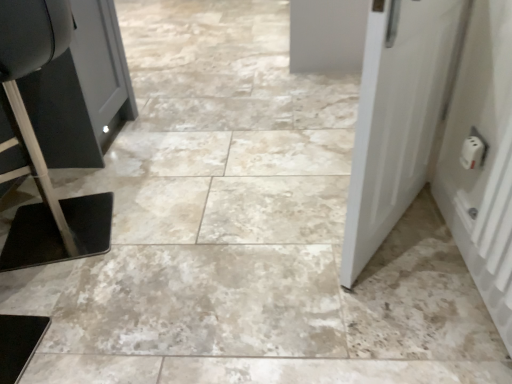
The image size is (512, 384). What do you see at coordinates (472, 152) in the screenshot?
I see `white plastic outlet at right` at bounding box center [472, 152].

The image size is (512, 384). In order to click on white matte door at right, positioned as the 2th door in right-to-left order in this screenshot , I will do `click(398, 115)`.

The width and height of the screenshot is (512, 384). I want to click on white plastic outlet at right, so click(x=472, y=152).

Is white plastic outlet at right far away from white plastic door at right, marked as the first door in a right-to-left arrangement?

No, there isn't a large distance between white plastic outlet at right and white plastic door at right, marked as the first door in a right-to-left arrangement.

From the image's perspective, is white plastic outlet at right over white plastic door at right, arranged as the 2th door when viewed from the left?

Correct, white plastic outlet at right appears higher than white plastic door at right, arranged as the 2th door when viewed from the left, in the image.

Which is in front, white plastic outlet at right or white plastic door at right, marked as the first door in a right-to-left arrangement?

white plastic door at right, marked as the first door in a right-to-left arrangement, is closer to the camera.

Is white plastic door at right, arranged as the 2th door when viewed from the left, oriented towards white matte door at right, the first door in the left-to-right sequence?

No, white plastic door at right, arranged as the 2th door when viewed from the left, does not turn towards white matte door at right, the first door in the left-to-right sequence.

Who is shorter, white plastic door at right, arranged as the 2th door when viewed from the left, or white matte door at right, the first door in the left-to-right sequence?

white plastic door at right, arranged as the 2th door when viewed from the left.

Would you say white plastic door at right, arranged as the 2th door when viewed from the left, is to the left or to the right of white matte door at right, the first door in the left-to-right sequence, in the picture?

From the image, it's evident that white plastic door at right, arranged as the 2th door when viewed from the left, is to the right of white matte door at right, the first door in the left-to-right sequence.

Is white plastic door at right, marked as the first door in a right-to-left arrangement, positioned behind white matte door at right, the first door in the left-to-right sequence?

No, it is not.

From the image's perspective, is white plastic door at right, marked as the first door in a right-to-left arrangement, above white plastic outlet at right?

No, from the image's perspective, white plastic door at right, marked as the first door in a right-to-left arrangement, is not above white plastic outlet at right.

Which of these two, white plastic door at right, marked as the first door in a right-to-left arrangement, or white plastic outlet at right, stands taller?

white plastic door at right, marked as the first door in a right-to-left arrangement, is taller.

Who is smaller, white plastic door at right, marked as the first door in a right-to-left arrangement, or white plastic outlet at right?

Smaller between the two is white plastic outlet at right.

Is white plastic outlet at right at the back of white plastic door at right, marked as the first door in a right-to-left arrangement?

white plastic door at right, marked as the first door in a right-to-left arrangement, does not have its back to white plastic outlet at right.

Would you say white matte door at right, positioned as the 2th door in right-to-left order, contains white plastic outlet at right?

No, white matte door at right, positioned as the 2th door in right-to-left order, does not contain white plastic outlet at right.

From the image's perspective, is white matte door at right, the first door in the left-to-right sequence, located above or below white plastic outlet at right?

white matte door at right, the first door in the left-to-right sequence, is above white plastic outlet at right.

Considering the relative sizes of white matte door at right, positioned as the 2th door in right-to-left order, and white plastic outlet at right in the image provided, is white matte door at right, positioned as the 2th door in right-to-left order, thinner than white plastic outlet at right?

Incorrect, the width of white matte door at right, positioned as the 2th door in right-to-left order, is not less than that of white plastic outlet at right.

This screenshot has width=512, height=384. What are the coordinates of `electric outlet behind the white matte door at right, positioned as the 2th door in right-to-left order` in the screenshot? It's located at (472, 152).

Considering the sizes of white plastic outlet at right and white matte door at right, the first door in the left-to-right sequence, in the image, is white plastic outlet at right wider or thinner than white matte door at right, the first door in the left-to-right sequence,?

Considering their sizes, white plastic outlet at right looks slimmer than white matte door at right, the first door in the left-to-right sequence.

In terms of size, does white plastic outlet at right appear bigger or smaller than white matte door at right, the first door in the left-to-right sequence?

Clearly, white plastic outlet at right is smaller in size than white matte door at right, the first door in the left-to-right sequence.

How far apart are white plastic outlet at right and white matte door at right, positioned as the 2th door in right-to-left order?

A distance of 35.17 centimeters exists between white plastic outlet at right and white matte door at right, positioned as the 2th door in right-to-left order.

Considering the sizes of objects white plastic outlet at right and white matte door at right, positioned as the 2th door in right-to-left order, in the image provided, who is shorter, white plastic outlet at right or white matte door at right, positioned as the 2th door in right-to-left order,?

white plastic outlet at right.

Where is `door below the white matte door at right, positioned as the 2th door in right-to-left order (from the image's perspective)`? The image size is (512, 384). door below the white matte door at right, positioned as the 2th door in right-to-left order (from the image's perspective) is located at coordinates (484, 159).

Consider the image. Is white matte door at right, positioned as the 2th door in right-to-left order, closer to camera compared to white plastic door at right, arranged as the 2th door when viewed from the left?

No, white matte door at right, positioned as the 2th door in right-to-left order, is further to the viewer.

Considering the positions of point (364, 162) and point (481, 223), is point (364, 162) closer or farther from the camera than point (481, 223)?

Clearly, point (364, 162) is closer to the camera than point (481, 223).

The height and width of the screenshot is (384, 512). Identify the location of the 1st door counting from the left side of the white plastic outlet at right. (484, 159).

Image resolution: width=512 pixels, height=384 pixels. I want to click on door on the right of white matte door at right, positioned as the 2th door in right-to-left order, so click(x=484, y=159).

Which object lies nearer to the anchor point white matte door at right, positioned as the 2th door in right-to-left order, white plastic door at right, arranged as the 2th door when viewed from the left, or white plastic outlet at right?

white plastic door at right, arranged as the 2th door when viewed from the left, is positioned closer to the anchor white matte door at right, positioned as the 2th door in right-to-left order.

Based on their spatial positions, is white matte door at right, positioned as the 2th door in right-to-left order, or white plastic outlet at right closer to white plastic door at right, arranged as the 2th door when viewed from the left?

white plastic outlet at right is closer to white plastic door at right, arranged as the 2th door when viewed from the left.

When comparing their distances from white plastic door at right, arranged as the 2th door when viewed from the left, does white plastic outlet at right or white matte door at right, the first door in the left-to-right sequence, seem closer?

white plastic outlet at right is positioned closer to the anchor white plastic door at right, arranged as the 2th door when viewed from the left.

Considering their positions, is white matte door at right, the first door in the left-to-right sequence, positioned closer to white plastic outlet at right than white plastic door at right, arranged as the 2th door when viewed from the left?

The object closer to white plastic outlet at right is white plastic door at right, arranged as the 2th door when viewed from the left.

Based on their spatial positions, is white plastic outlet at right or white plastic door at right, marked as the first door in a right-to-left arrangement, closer to white matte door at right, the first door in the left-to-right sequence?

white plastic door at right, marked as the first door in a right-to-left arrangement, is closer to white matte door at right, the first door in the left-to-right sequence.

When comparing their distances from white plastic outlet at right, does white plastic door at right, arranged as the 2th door when viewed from the left, or white matte door at right, the first door in the left-to-right sequence, seem further?

white matte door at right, the first door in the left-to-right sequence, is positioned further to the anchor white plastic outlet at right.

The image size is (512, 384). What are the coordinates of `door positioned between white plastic door at right, arranged as the 2th door when viewed from the left, and white plastic outlet at right from near to far` in the screenshot? It's located at (398, 115).